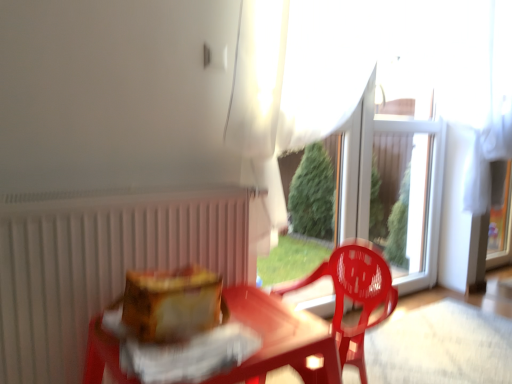
Question: From the image's perspective, would you say white matte radiator at left is shown under translucent plastic chair at center?

Choices:
 (A) no
 (B) yes

Answer: (A)

Question: From a real-world perspective, is white matte radiator at left positioned over translucent plastic chair at center based on gravity?

Choices:
 (A) no
 (B) yes

Answer: (B)

Question: Is white matte radiator at left positioned with its back to translucent plastic chair at center?

Choices:
 (A) no
 (B) yes

Answer: (A)

Question: From a real-world perspective, is white matte radiator at left positioned under translucent plastic chair at center based on gravity?

Choices:
 (A) no
 (B) yes

Answer: (A)

Question: Is white matte radiator at left positioned behind translucent plastic chair at center?

Choices:
 (A) no
 (B) yes

Answer: (A)

Question: Would you say white sheer curtain at upper center is inside or outside translucent plastic chair at center?

Choices:
 (A) inside
 (B) outside

Answer: (B)

Question: Considering the positions of white sheer curtain at upper center and translucent plastic chair at center in the image, is white sheer curtain at upper center bigger or smaller than translucent plastic chair at center?

Choices:
 (A) small
 (B) big

Answer: (B)

Question: From the image's perspective, is white sheer curtain at upper center positioned above or below translucent plastic chair at center?

Choices:
 (A) below
 (B) above

Answer: (B)

Question: Considering the positions of white sheer curtain at upper center and translucent plastic chair at center in the image, is white sheer curtain at upper center wider or thinner than translucent plastic chair at center?

Choices:
 (A) thin
 (B) wide

Answer: (A)

Question: Would you say white sheer curtain at upper center is to the left or to the right of transparent plastic glass door at center in the picture?

Choices:
 (A) right
 (B) left

Answer: (B)

Question: Is white sheer curtain at upper center taller or shorter than transparent plastic glass door at center?

Choices:
 (A) tall
 (B) short

Answer: (B)

Question: Is point (339, 122) closer or farther from the camera than point (424, 248)?

Choices:
 (A) closer
 (B) farther

Answer: (A)

Question: From a real-world perspective, is white sheer curtain at upper center above or below transparent plastic glass door at center?

Choices:
 (A) below
 (B) above

Answer: (B)

Question: Based on their positions, is white matte radiator at left located to the left or right of white sheer curtain at upper center?

Choices:
 (A) right
 (B) left

Answer: (B)

Question: Is white matte radiator at left in front of or behind white sheer curtain at upper center in the image?

Choices:
 (A) front
 (B) behind

Answer: (A)